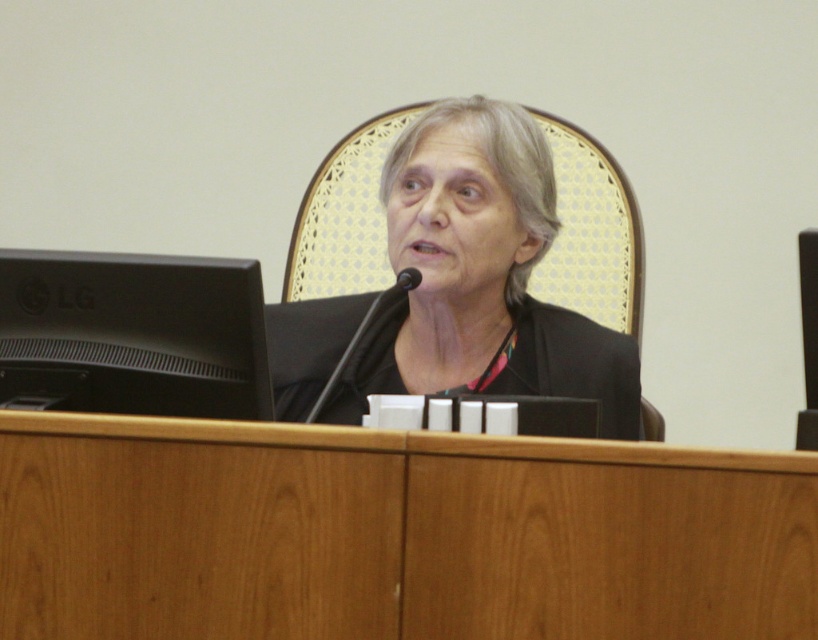
Question: Which object is the farthest from the black matte monitor at left?

Choices:
 (A) black plastic microphone at center
 (B) black matte/black fabric at center

Answer: (B)

Question: Does black matte/black fabric at center come in front of black matte monitor at left?

Choices:
 (A) yes
 (B) no

Answer: (B)

Question: Is black matte monitor at left wider than black plastic microphone at center?

Choices:
 (A) no
 (B) yes

Answer: (B)

Question: Is black matte/black fabric at center wider than black matte monitor at left?

Choices:
 (A) no
 (B) yes

Answer: (B)

Question: Considering the real-world distances, which object is closest to the black plastic microphone at center?

Choices:
 (A) black matte/black fabric at center
 (B) black matte monitor at left

Answer: (A)

Question: Which object appears closest to the camera in this image?

Choices:
 (A) black plastic microphone at center
 (B) black matte monitor at left
 (C) black matte/black fabric at center

Answer: (B)